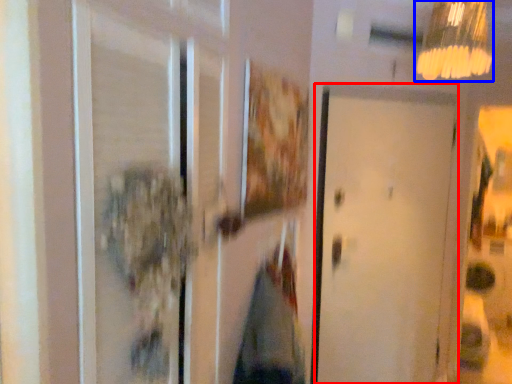
Question: Which of the following is the closest to the observer, door (highlighted by a red box) or lamp (highlighted by a blue box)?

Choices:
 (A) door
 (B) lamp

Answer: (B)